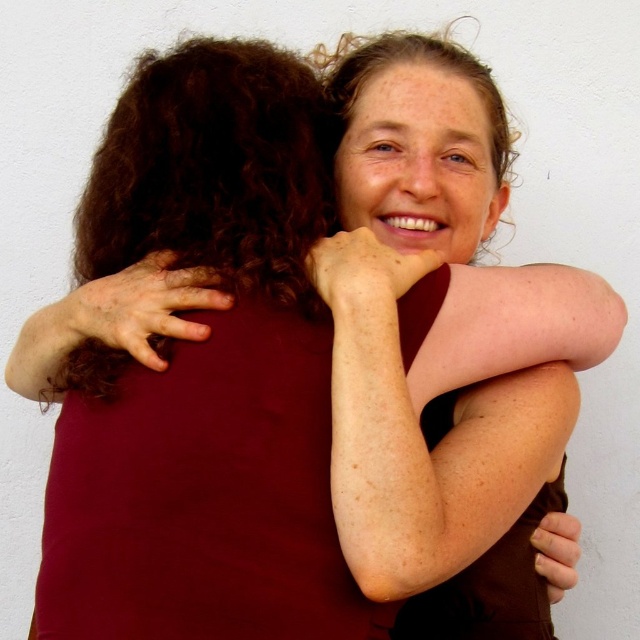
Is point (332, 461) positioned behind point (156, 360)?

No, it is not.

Between point (371, 556) and point (198, 328), which one is positioned in front?

Point (371, 556) is in front.

Where is `smooth skin arm at center`? The width and height of the screenshot is (640, 640). smooth skin arm at center is located at coordinates (420, 435).